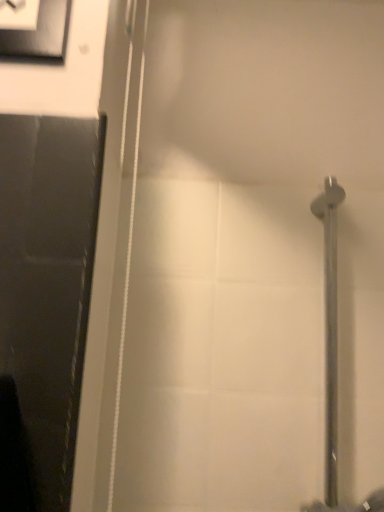
Measure the distance between point (23, 40) and camera.

The depth of point (23, 40) is 23.66 inches.

Where is `matte black frame at upper left`? The width and height of the screenshot is (384, 512). matte black frame at upper left is located at coordinates (40, 34).

Measure the distance between matte black frame at upper left and camera.

They are 23.43 inches apart.

Describe the element at coordinates (40, 34) in the screenshot. I see `matte black frame at upper left` at that location.

This screenshot has height=512, width=384. I want to click on matte black frame at upper left, so click(40, 34).